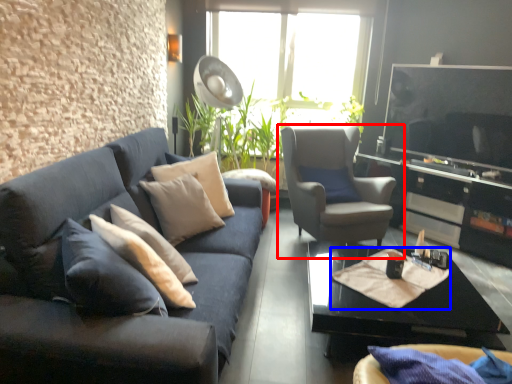
Question: Which object appears closest to the camera in this image, chair (highlighted by a red box) or material (highlighted by a blue box)?

Choices:
 (A) chair
 (B) material

Answer: (B)